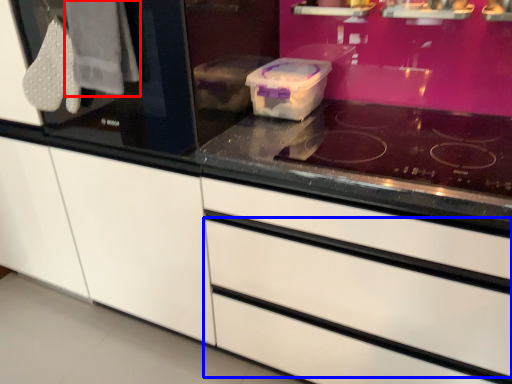
Question: Among these objects, which one is farthest to the camera, clothe (highlighted by a red box) or drawer (highlighted by a blue box)?

Choices:
 (A) clothe
 (B) drawer

Answer: (A)